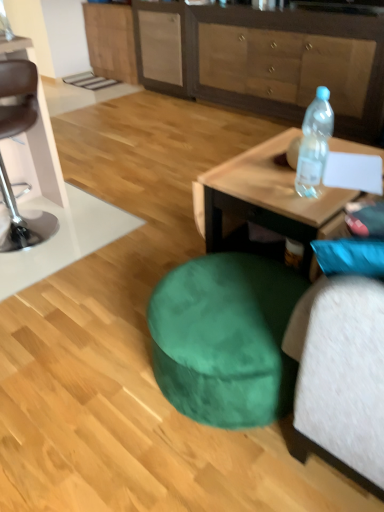
The width and height of the screenshot is (384, 512). What are the coordinates of `vacant area that lies to the right of brown leather bar stool at left` in the screenshot? It's located at (102, 198).